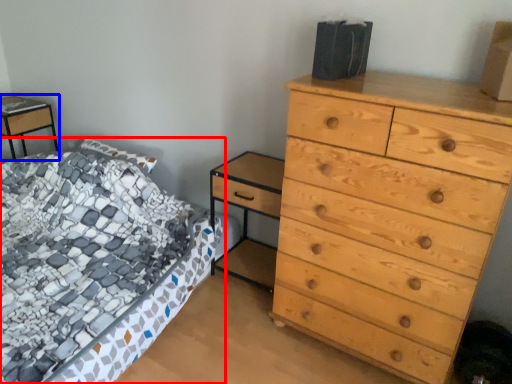
Question: Which point is closer to the camera, bed (highlighted by a red box) or nightstand (highlighted by a blue box)?

Choices:
 (A) bed
 (B) nightstand

Answer: (A)